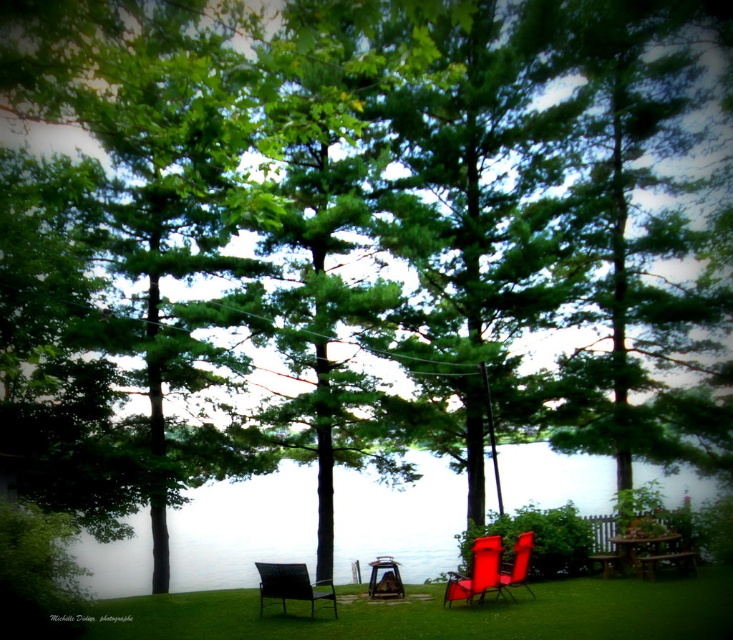
You are standing at the edge of the lake in the serene lakeside scene. You notice two points marked in the image. Which point, point (368, 541) or point (279, 576), is closer to your current position?

Point (368, 541) is further to the viewer than point (279, 576). Therefore, point (368, 541) is closer to your current position at the edge of the lake.

You are standing at the point marked as point (243, 529) in the image. What do you see directly in front of you?

Transparent water at center is located at point (243, 529), so you would see transparent water at center directly in front of you.

From the picture: You are standing at the edge of the lakeside and want to place a small potted plant on the ground. The potted plant needs to be placed between the green grass at center and the metallic silver chair at center. Is this possible?

The green grass at center is located above the metallic silver chair at center, so there is no space between them for placing the potted plant.